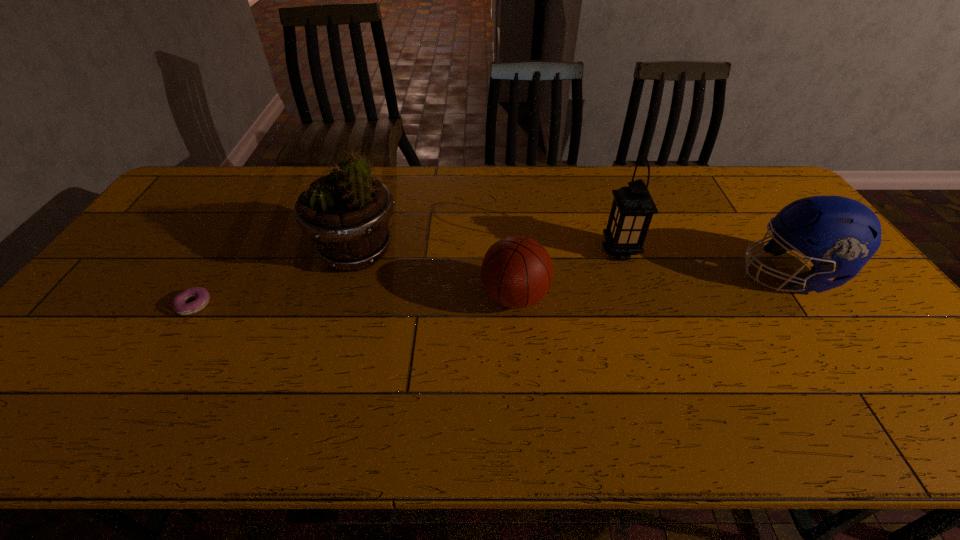
At what (x,y) coordinates should I click in order to perform the action: click on vacant space at the right edge. Please return your answer as a coordinate pair (x, y). Looking at the image, I should click on (780, 206).

Where is `vacant space at the far right corner of the desktop`? This screenshot has width=960, height=540. vacant space at the far right corner of the desktop is located at coordinates (755, 199).

You are a GUI agent. You are given a task and a screenshot of the screen. Output one action in this format:
    pyautogui.click(x=<x>, y=<y>)
    Task: Click on the unoccupied position between the second object from right to left and the football helmet
    The width and height of the screenshot is (960, 540).
    Given the screenshot: What is the action you would take?
    pyautogui.click(x=705, y=262)

You are a GUI agent. You are given a task and a screenshot of the screen. Output one action in this format:
    pyautogui.click(x=<x>, y=<y>)
    Task: Click on the empty space that is in between the pastry and the fourth object from left to right
    The image size is (960, 540).
    Given the screenshot: What is the action you would take?
    pyautogui.click(x=407, y=278)

At what (x,y) coordinates should I click in order to perform the action: click on vacant area that lies between the flowerpot and the basketball. Please return your answer as a coordinate pair (x, y). Image resolution: width=960 pixels, height=540 pixels. Looking at the image, I should click on (436, 274).

Locate an element on the screen. The image size is (960, 540). blank region between the fourth shortest object and the shortest object is located at coordinates (407, 278).

The image size is (960, 540). I want to click on empty location between the flowerpot and the leftmost object, so click(x=276, y=279).

Identify the location of empty location between the third shortest object and the second shortest object. The image size is (960, 540). (652, 286).

Identify the location of free space between the second object from left to right and the football helmet. This screenshot has width=960, height=540. (573, 264).

The width and height of the screenshot is (960, 540). What are the coordinates of `free space between the fourth tallest object and the shortest object` in the screenshot? It's located at (354, 301).